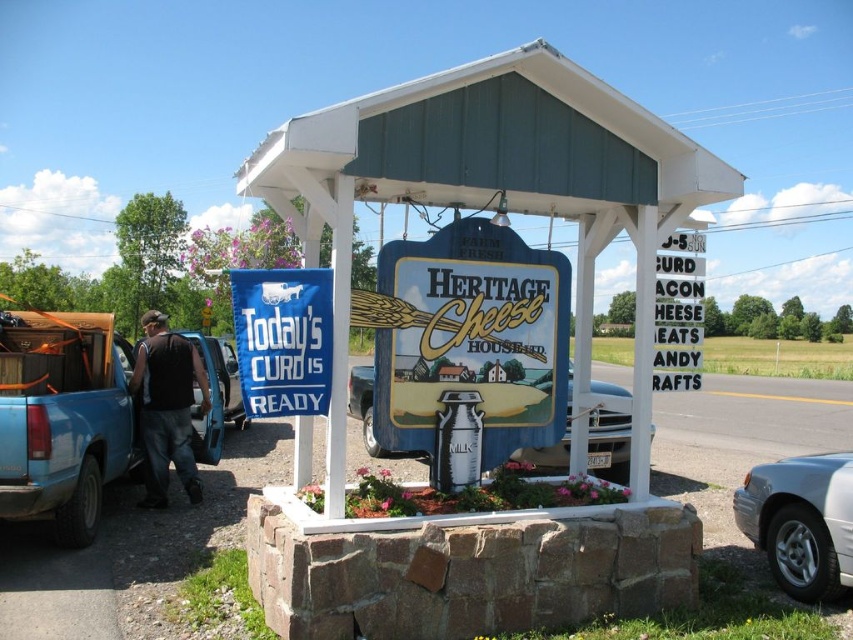
You are standing at the roadside and see the blue painted wood heritage cheese sign at center and the black fabric backpack at left. Which object is closer to you?

The blue painted wood heritage cheese sign at center is closer to you because it is in front of the black fabric backpack at left.

You are standing in front of the Heritage Cheese House sign and want to touch both points mentioned. Which point should you reach for first, the point at coordinate (45, 390) or the point at coordinate (320, 362)?

You should reach for the point at coordinate (45, 390) first because it is closer to you than the point at coordinate (320, 362).

You are standing in front of the Heritage Cheese House roadside sign. You notice a blue painted wood heritage cheese sign at center and a black fabric backpack at left. Which object is larger?

The black fabric backpack at left is larger than the blue painted wood heritage cheese sign at center.